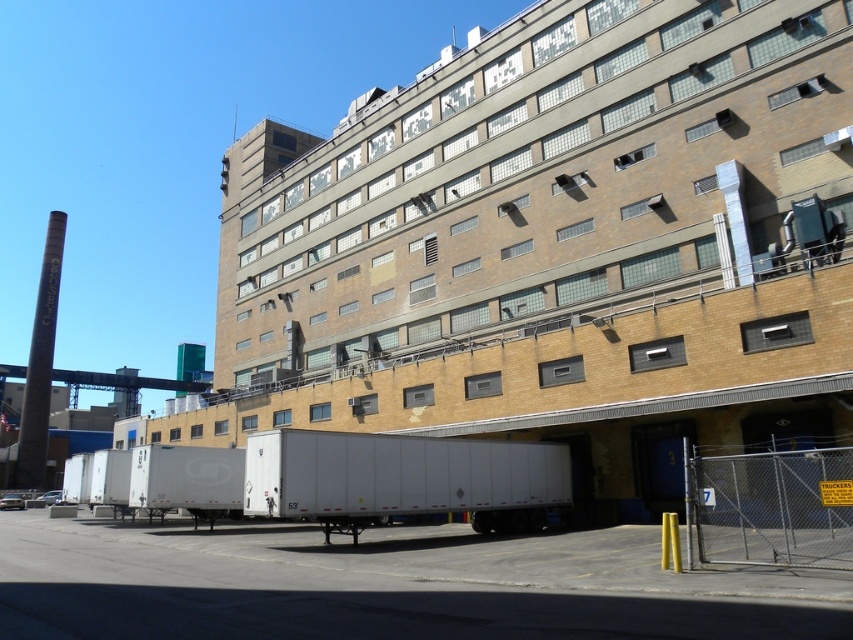
You are a delivery driver who needs to park your truck between the two white matte trailers. The white matte trailer at lower center and the white matte trailer truck at center are both in front of the building. Which direction should you drive to park your truck between them?

You should drive to the right of the white matte trailer at lower center to park between it and the white matte trailer truck at center since the white matte trailer at lower center is to the left of the white matte trailer truck at center.

You are a delivery driver who needs to park your truck under a low bridge that has a height restriction of 4 meters. You observe the white matte trailer at lower center and the white matte trailer truck at center. Which vehicle should you choose to ensure it can pass under the bridge?

The white matte trailer truck at center should be chosen because it has a lower height than the white matte trailer at lower center, making it more likely to pass under the 4 meter bridge.